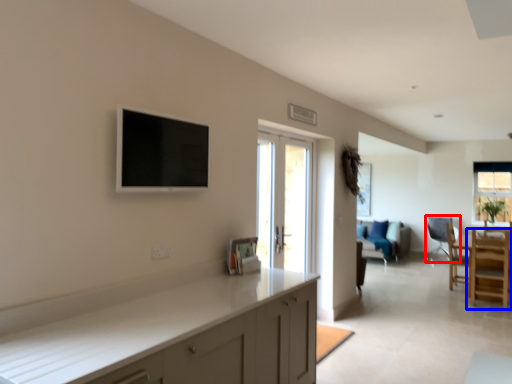
Question: Which object is closer to the camera taking this photo, chair (highlighted by a red box) or chair (highlighted by a blue box)?

Choices:
 (A) chair
 (B) chair

Answer: (B)